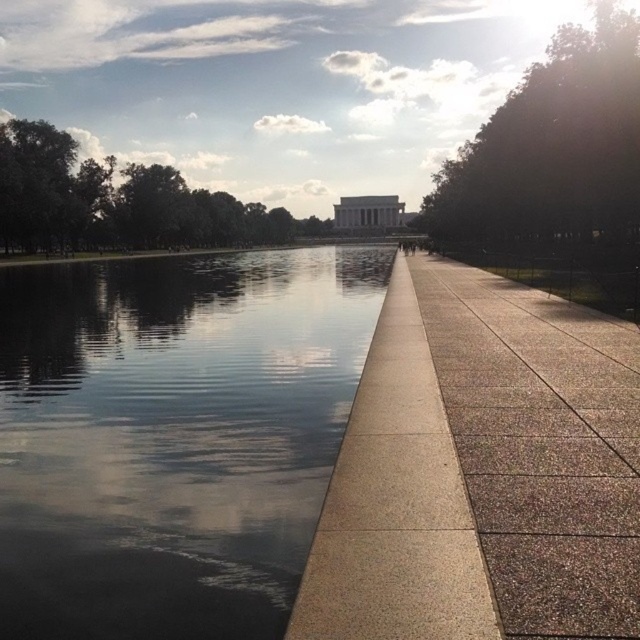
You are standing at the Reflecting Pool and looking towards the Lincoln Memorial. You notice a green leafy tree at upper right and green leafy trees at left. Which group of trees is closer to you?

The green leafy tree at upper right is positioned under the green leafy trees at left, meaning the green leafy trees at left are closer to you.

You are standing at the point marked as point (172, 436) in the image. What do you see directly in front of you?

You see glossy reflective water at center directly in front of you at point (172, 436).

You are a tourist standing at the Reflecting Pool looking towards the Lincoln Memorial. You see the glossy reflective water at center and the sanded concrete pavement at center. Which surface would you prefer to walk on if you want to avoid slipping?

The sanded concrete pavement at center is less slippery than the glossy reflective water at center, so you should walk on the sanded concrete pavement at center to avoid slipping.